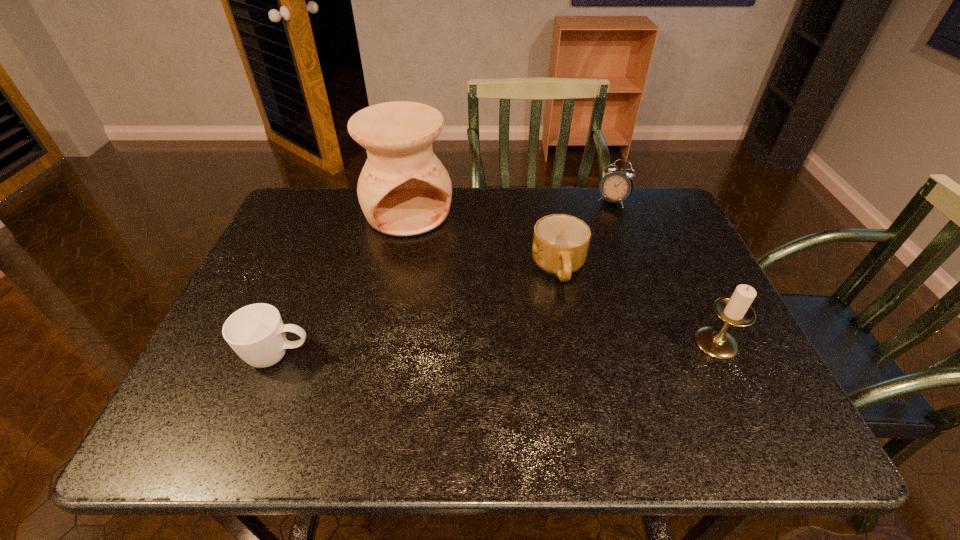
The height and width of the screenshot is (540, 960). I want to click on vacant position at the right edge of the desktop, so click(x=633, y=239).

Find the location of a particular element. free region at the far left corner of the desktop is located at coordinates (306, 212).

Locate an element on the screen. This screenshot has width=960, height=540. empty space between the pottery and the third nearest object is located at coordinates (483, 240).

Locate an element on the screen. Image resolution: width=960 pixels, height=540 pixels. free space between the second object from left to right and the cup is located at coordinates pyautogui.click(x=344, y=284).

Locate an element on the screen. The image size is (960, 540). vacant area that lies between the fourth shortest object and the fourth object from left to right is located at coordinates point(664,272).

Locate an element on the screen. Image resolution: width=960 pixels, height=540 pixels. vacant space that's between the fourth object from left to right and the leftmost object is located at coordinates (445, 279).

What are the coordinates of `vacant area that lies between the cup and the pottery` in the screenshot? It's located at (344, 284).

I want to click on free space between the leftmost object and the mug, so click(x=419, y=313).

Locate an element on the screen. This screenshot has height=540, width=960. free space between the third object from left to right and the fourth object from right to left is located at coordinates (483, 240).

Where is `free space between the fourth object from right to left and the fourth object from left to right`? The width and height of the screenshot is (960, 540). free space between the fourth object from right to left and the fourth object from left to right is located at coordinates 511,206.